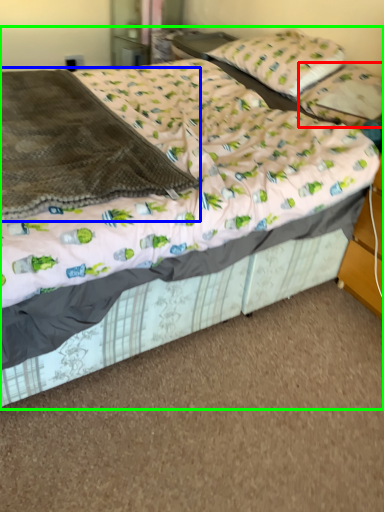
Question: Based on their relative distances, which object is farther from pillow (highlighted by a red box)? Choose from blanket (highlighted by a blue box) and bed (highlighted by a green box).

Choices:
 (A) blanket
 (B) bed

Answer: (A)